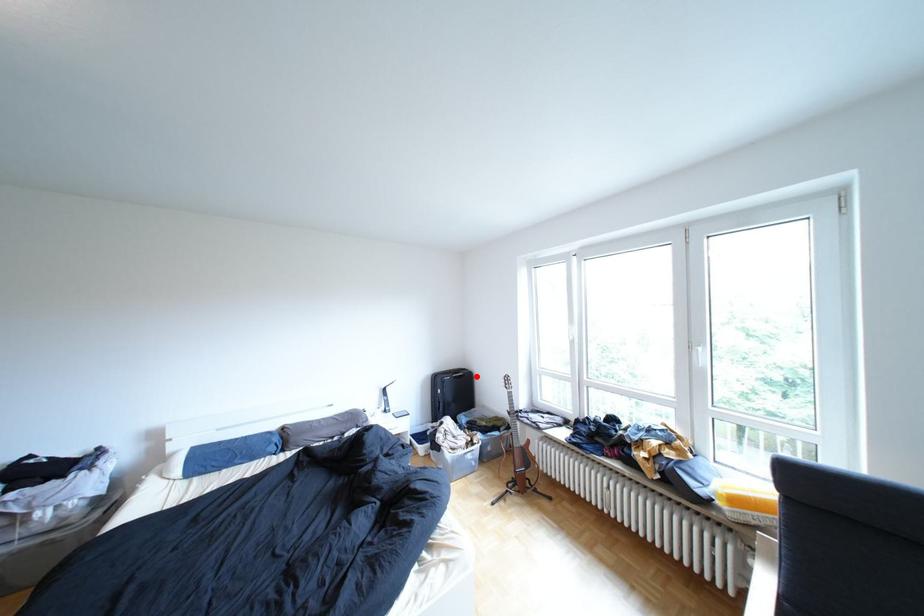
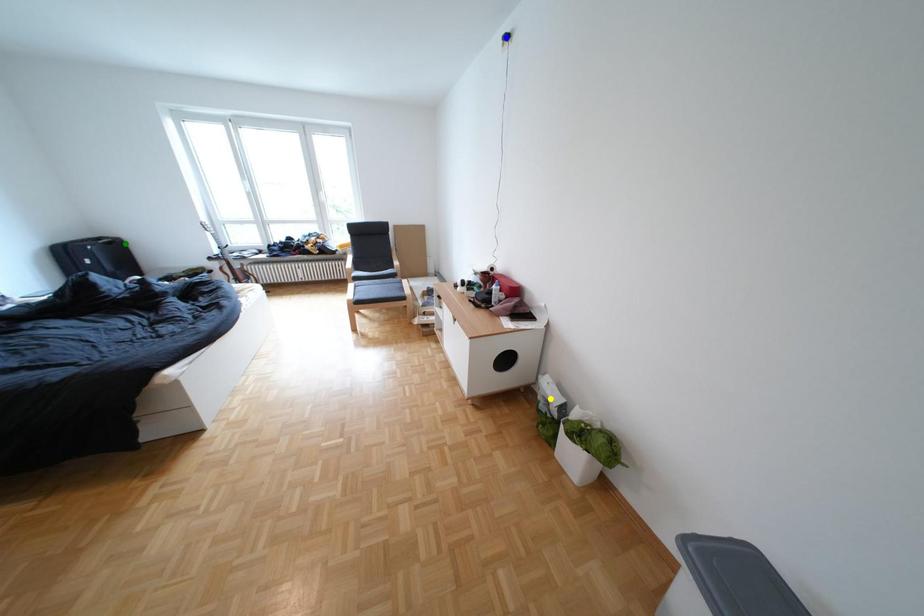
Question: I am providing you with two images of the same scene from different viewpoints. A red point is marked on the first image. You are given multiple points on the second image. Can you choose the point in image 2 that corresponds to the point in image 1?

Choices:
 (A) blue point
 (B) yellow point
 (C) green point

Answer: (C)